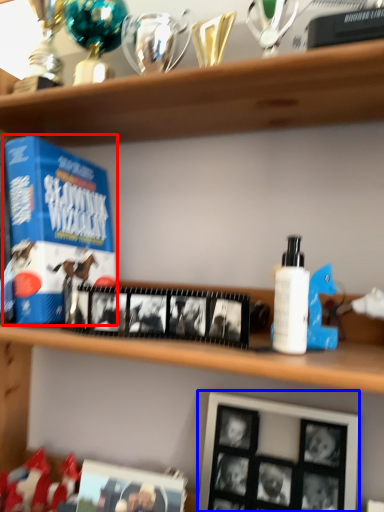
Question: Which point is closer to the camera, product (highlighted by a red box) or picture frame (highlighted by a blue box)?

Choices:
 (A) product
 (B) picture frame

Answer: (B)